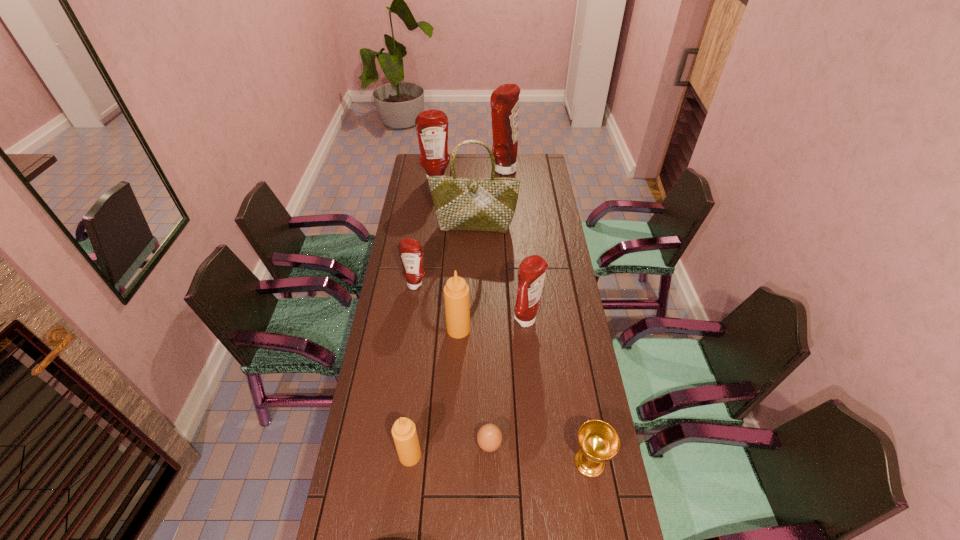
Where is `vacant space at the left edge`? This screenshot has width=960, height=540. vacant space at the left edge is located at coordinates (392, 302).

You are a GUI agent. You are given a task and a screenshot of the screen. Output one action in this format:
    pyautogui.click(x=<x>, y=<y>)
    Task: Click on the vacant space at the right edge
    
    Given the screenshot: What is the action you would take?
    pyautogui.click(x=581, y=339)

At what (x,y) coordinates should I click in order to perform the action: click on free space between the chalice and the third farthest object. Please return your answer as a coordinate pair (x, y). This screenshot has height=540, width=960. Looking at the image, I should click on (532, 344).

Find the location of a particular element. This screenshot has width=960, height=540. free point between the shopping bag and the boiled egg is located at coordinates (482, 335).

At what (x,y) coordinates should I click in order to perform the action: click on free space between the seventh shortest object and the farther tan condiment. Please return your answer as a coordinate pair (x, y). Image resolution: width=960 pixels, height=540 pixels. Looking at the image, I should click on (447, 255).

What are the coordinates of `blank region between the chalice and the tallest condiment` in the screenshot? It's located at (546, 316).

Find the location of a particular element. free space between the third biggest red condiment and the third farthest object is located at coordinates (500, 274).

Locate an element on the screen. This screenshot has width=960, height=540. vacant area that lies between the shopping bag and the bigger tan condiment is located at coordinates pos(467,278).

Where is `object that is the fifth closest to the smaller tan condiment`? object that is the fifth closest to the smaller tan condiment is located at coordinates (410, 250).

Locate an element on the screen. This screenshot has height=540, width=960. the third closest object to the smallest red condiment is located at coordinates coord(532,270).